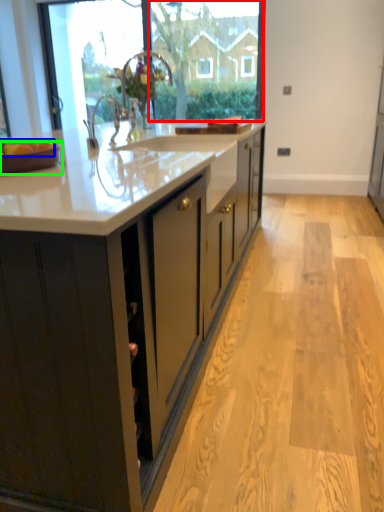
Question: Which object is the closest to the window screen (highlighted by a red box)? Choose among these: apple (highlighted by a blue box) or tray (highlighted by a green box).

Choices:
 (A) apple
 (B) tray

Answer: (A)